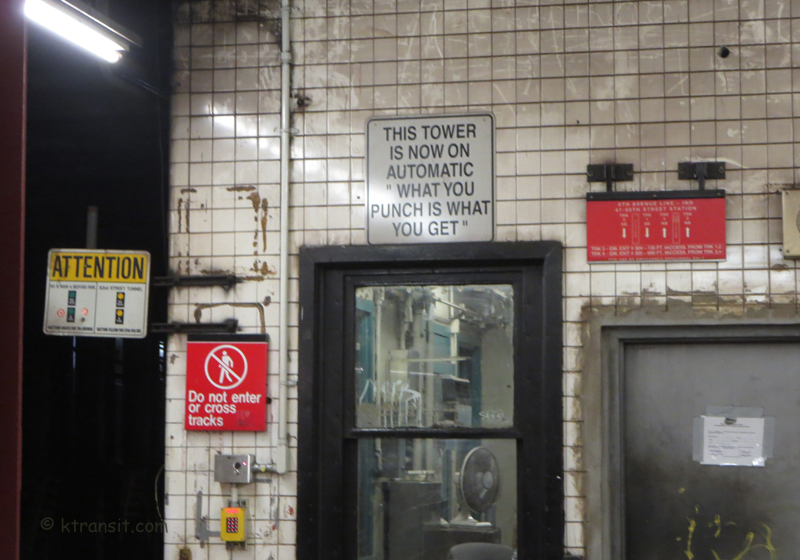
This screenshot has height=560, width=800. In order to click on sign taped to door in this screenshot , I will do `click(733, 454)`.